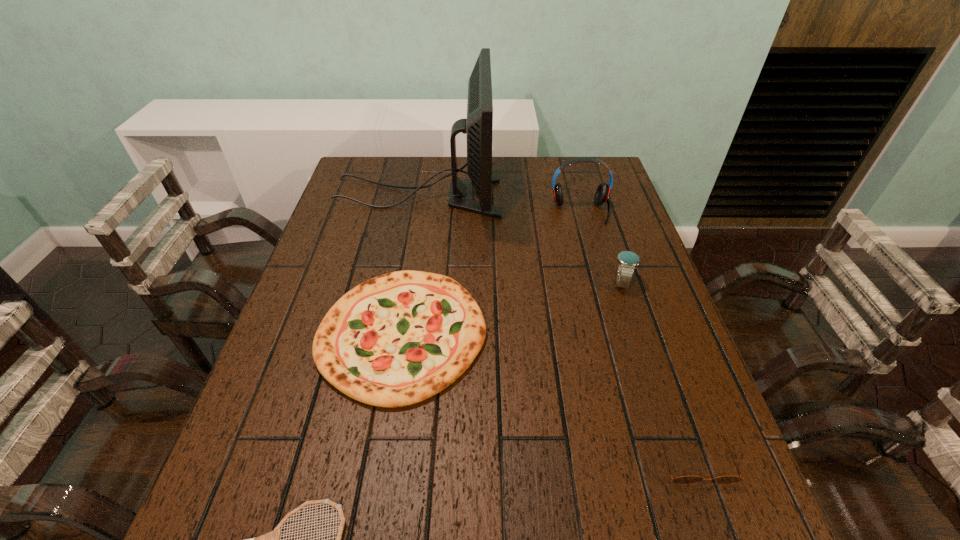
In the image, there is a desktop. Identify the location of vacant space at the right edge. This screenshot has height=540, width=960. (608, 297).

Identify the location of vacant space at the far left corner. (377, 190).

Where is `vacant area at the far right corner of the desktop`? The height and width of the screenshot is (540, 960). vacant area at the far right corner of the desktop is located at coordinates (602, 158).

Locate an element on the screen. This screenshot has width=960, height=540. vacant space that's between the fourth shortest object and the fourth tallest object is located at coordinates (513, 308).

At what (x,y) coordinates should I click in order to perform the action: click on unoccupied area between the pizza and the fourth shortest object. Please return your answer as a coordinate pair (x, y). The height and width of the screenshot is (540, 960). Looking at the image, I should click on (513, 308).

At what (x,y) coordinates should I click in order to perform the action: click on unoccupied area between the third shortest object and the tallest object. Please return your answer as a coordinate pair (x, y). Looking at the image, I should click on (410, 265).

This screenshot has width=960, height=540. In order to click on free space between the pizza and the fourth shortest object in this screenshot , I will do `click(513, 308)`.

Locate an element on the screen. This screenshot has height=540, width=960. empty location between the fourth tallest object and the second nearest object is located at coordinates (549, 397).

Locate an element on the screen. This screenshot has height=540, width=960. vacant point located between the third tallest object and the headset is located at coordinates (601, 247).

In order to click on free space that is in between the tallest object and the fourth shortest object in this screenshot , I will do `click(520, 239)`.